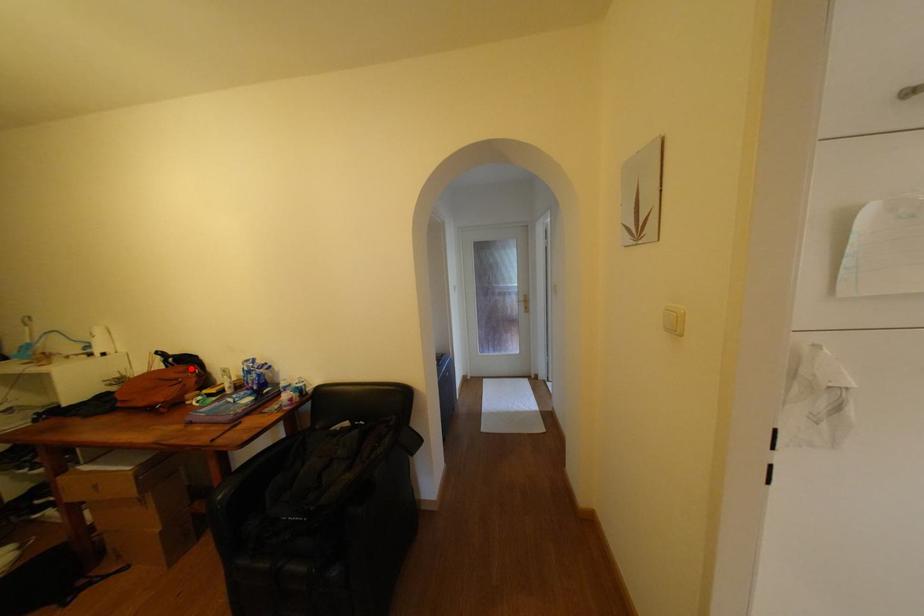
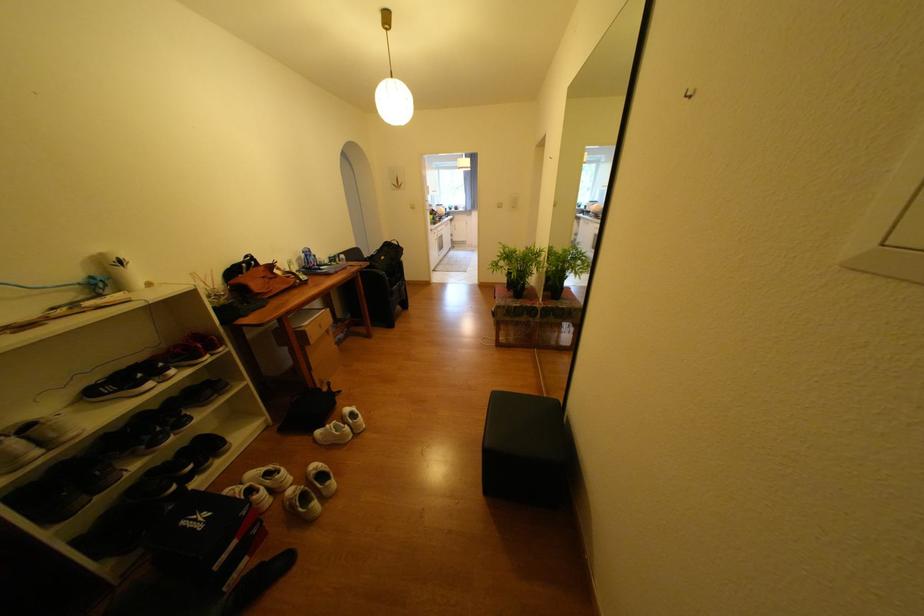
Question: I am providing you with two images of the same scene from different viewpoints. Given a red point in image1, look at the same physical point in image2. Is it:

Choices:
 (A) Closer to the viewpoint
 (B) Farther from the viewpoint

Answer: (A)